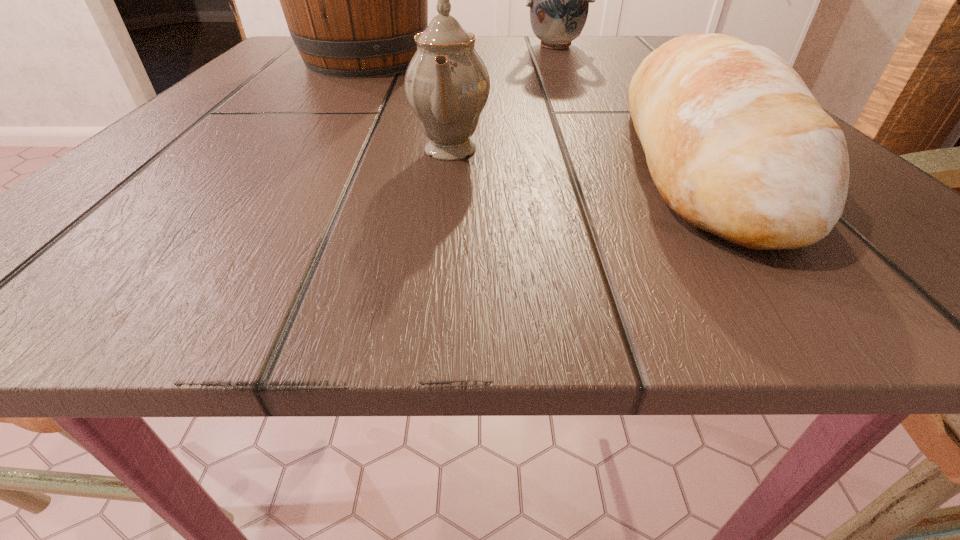
Where is `cider that is at the far edge`? Image resolution: width=960 pixels, height=540 pixels. cider that is at the far edge is located at coordinates (353, 0).

In order to click on pottery present at the far edge in this screenshot , I will do `click(559, 0)`.

This screenshot has height=540, width=960. I want to click on object that is at the near edge, so click(737, 145).

Identify the location of object present at the left edge. (353, 0).

At what (x,y) coordinates should I click in order to perform the action: click on object at the right edge. Please return your answer as a coordinate pair (x, y). Looking at the image, I should click on (737, 145).

At what (x,y) coordinates should I click in order to perform the action: click on object that is at the far left corner. Please return your answer as a coordinate pair (x, y). This screenshot has width=960, height=540. Looking at the image, I should click on (353, 0).

At what (x,y) coordinates should I click in order to perform the action: click on object that is positioned at the near right corner. Please return your answer as a coordinate pair (x, y). The image size is (960, 540). Looking at the image, I should click on (737, 145).

Find the location of a particular element. Image resolution: width=960 pixels, height=540 pixels. vacant area at the far edge of the desktop is located at coordinates (479, 52).

The height and width of the screenshot is (540, 960). I want to click on vacant area at the near edge of the desktop, so pos(271,229).

Find the location of `vacant region at the left edge of the desktop`. vacant region at the left edge of the desktop is located at coordinates (302, 89).